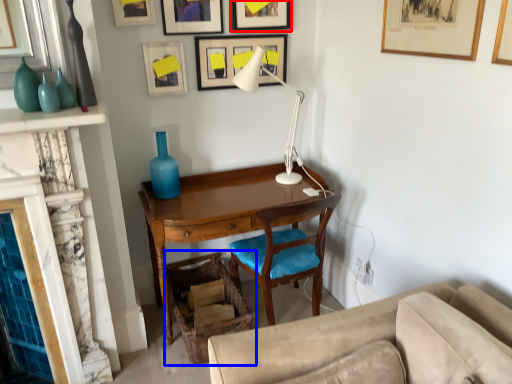
Question: Which point is closer to the camera, picture frame (highlighted by a red box) or swivel chair (highlighted by a blue box)?

Choices:
 (A) picture frame
 (B) swivel chair

Answer: (B)